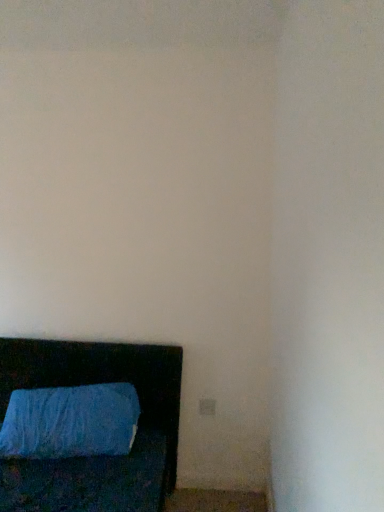
The height and width of the screenshot is (512, 384). What are the coordinates of `blue fabric pillow at lower left` in the screenshot? It's located at (103, 456).

What is the approximate height of blue fabric pillow at lower left?

The height of blue fabric pillow at lower left is 18.22 inches.

Describe the element at coordinates (103, 456) in the screenshot. I see `blue fabric pillow at lower left` at that location.

The height and width of the screenshot is (512, 384). I want to click on blue fabric pillow at lower left, so click(x=103, y=456).